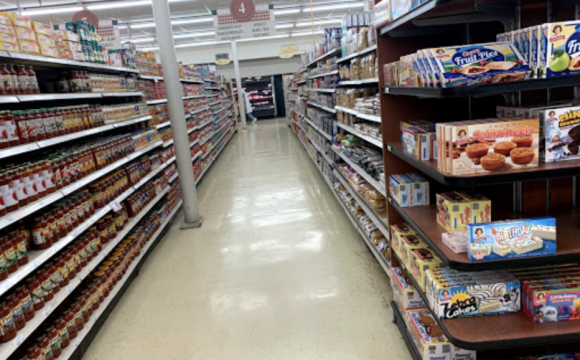
The image size is (580, 360). I want to click on floor, so click(172, 291).